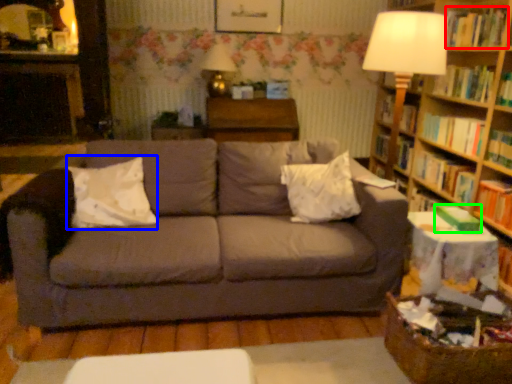
Question: Which object is the closest to the book (highlighted by a red box)? Choose among these: pillow (highlighted by a blue box) or paperback book (highlighted by a green box).

Choices:
 (A) pillow
 (B) paperback book

Answer: (B)